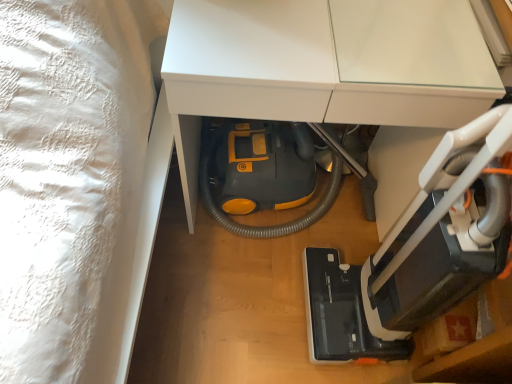
Question: In the image, is yellow plastic vacuum cleaner at lower center positioned in front of or behind black plastic vacuum cleaner at lower right?

Choices:
 (A) behind
 (B) front

Answer: (A)

Question: From the image's perspective, is yellow plastic vacuum cleaner at lower center located above or below black plastic vacuum cleaner at lower right?

Choices:
 (A) above
 (B) below

Answer: (A)

Question: From a real-world perspective, is yellow plastic vacuum cleaner at lower center positioned above or below black plastic vacuum cleaner at lower right?

Choices:
 (A) below
 (B) above

Answer: (A)

Question: From the image's perspective, is black plastic vacuum cleaner at lower right located above or below yellow plastic vacuum cleaner at lower center?

Choices:
 (A) above
 (B) below

Answer: (B)

Question: In the image, is black plastic vacuum cleaner at lower right positioned in front of or behind yellow plastic vacuum cleaner at lower center?

Choices:
 (A) front
 (B) behind

Answer: (A)

Question: Considering the positions of black plastic vacuum cleaner at lower right and yellow plastic vacuum cleaner at lower center in the image, is black plastic vacuum cleaner at lower right bigger or smaller than yellow plastic vacuum cleaner at lower center?

Choices:
 (A) big
 (B) small

Answer: (B)

Question: In the image, is black plastic vacuum cleaner at lower right on the left side or the right side of yellow plastic vacuum cleaner at lower center?

Choices:
 (A) right
 (B) left

Answer: (A)